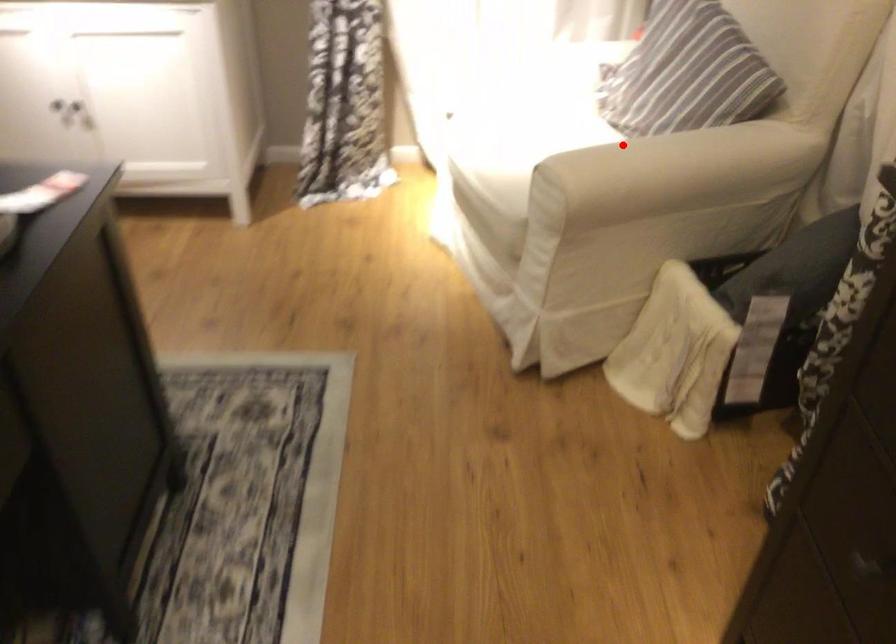
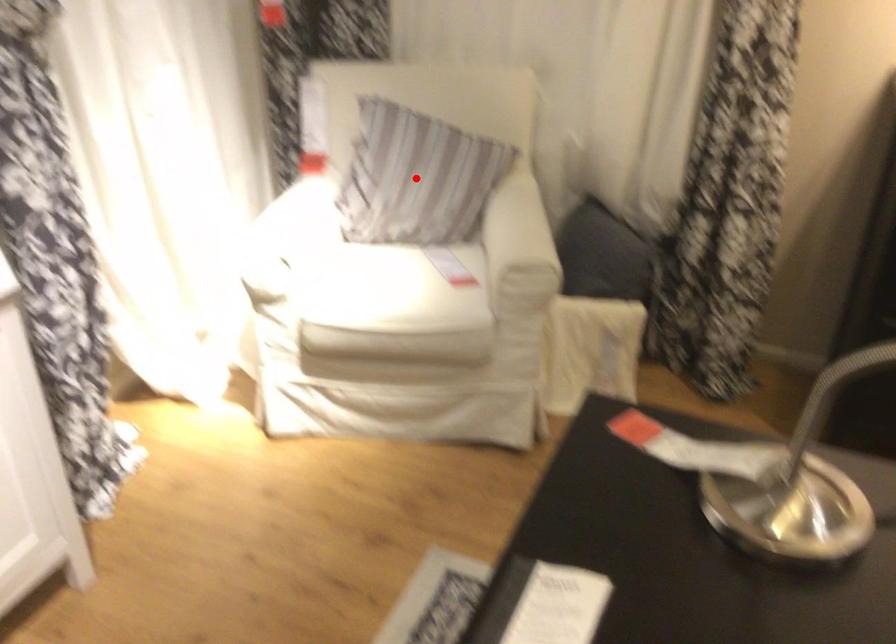
I am providing you with two images of the same scene from different viewpoints. A red point is marked on the first image and another point is marked on the second image. Is the marked point in image1 the same physical position as the marked point in image2?

No